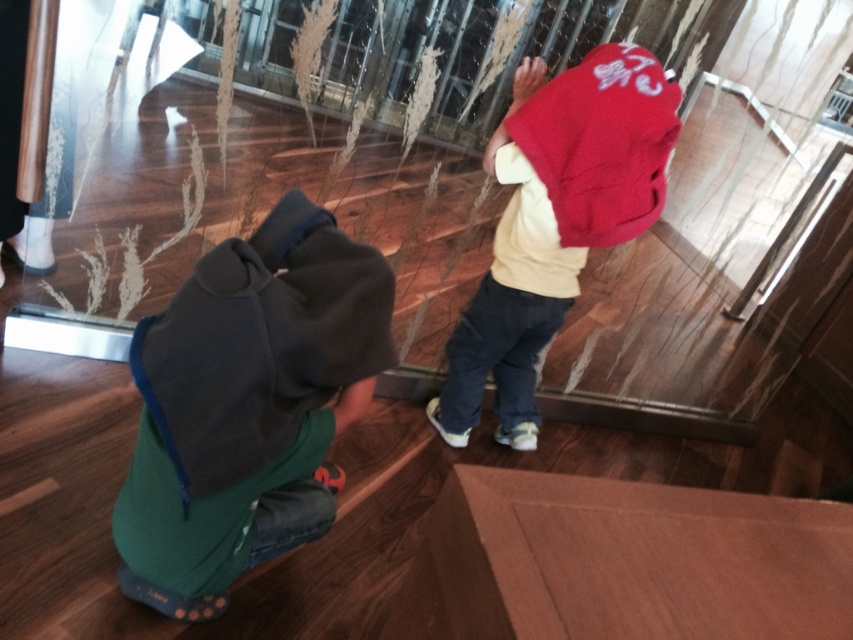
Question: Which object appears closest to the camera in this image?

Choices:
 (A) dark gray fleece jacket at lower left
 (B) transparent glass door at center
 (C) red fleece jacket at center

Answer: (A)

Question: Which point is farther to the camera?

Choices:
 (A) red fleece jacket at center
 (B) transparent glass door at center

Answer: (A)

Question: Is transparent glass door at center further to the viewer compared to dark gray fleece jacket at lower left?

Choices:
 (A) yes
 (B) no

Answer: (A)

Question: Considering the relative positions of transparent glass door at center and dark gray fleece jacket at lower left in the image provided, where is transparent glass door at center located with respect to dark gray fleece jacket at lower left?

Choices:
 (A) right
 (B) left

Answer: (A)

Question: Which object is farther from the camera taking this photo?

Choices:
 (A) dark gray fleece jacket at lower left
 (B) transparent glass door at center

Answer: (B)

Question: From the image, what is the correct spatial relationship of dark gray fleece jacket at lower left in relation to red fleece jacket at center?

Choices:
 (A) right
 (B) left

Answer: (B)